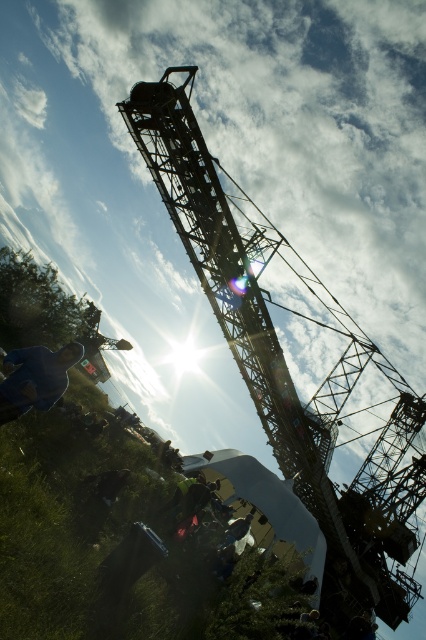
Question: Does metallic structure at center have a lesser width compared to blue fabric jacket at lower left?

Choices:
 (A) yes
 (B) no

Answer: (B)

Question: Which point appears closest to the camera in this image?

Choices:
 (A) (324, 346)
 (B) (19, 387)

Answer: (B)

Question: Is metallic structure at center to the right of blue fabric jacket at lower left from the viewer's perspective?

Choices:
 (A) yes
 (B) no

Answer: (A)

Question: Which object is closer to the camera taking this photo?

Choices:
 (A) metallic structure at center
 (B) blue fabric jacket at lower left

Answer: (A)

Question: Can you confirm if metallic structure at center is positioned to the left of blue fabric jacket at lower left?

Choices:
 (A) yes
 (B) no

Answer: (B)